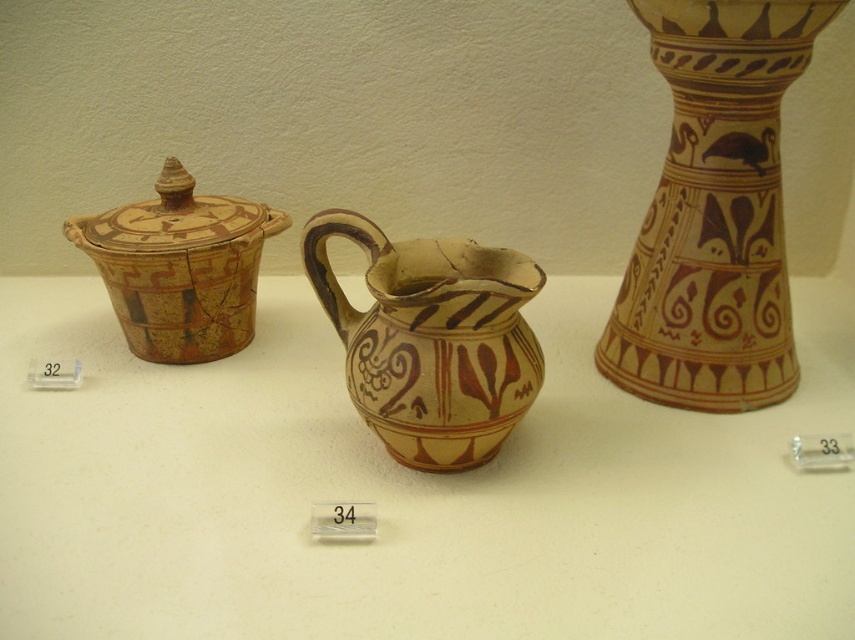
Question: Among these points, which one is nearest to the camera?

Choices:
 (A) (248, 285)
 (B) (435, 352)
 (C) (700, 513)
 (D) (780, 312)

Answer: (B)

Question: Does matte ceramic pitcher at center appear on the right side of matte clay pot at left?

Choices:
 (A) yes
 (B) no

Answer: (A)

Question: Is matte ceramic pitcher at center positioned before matte clay pitcher at center?

Choices:
 (A) no
 (B) yes

Answer: (B)

Question: Based on their relative distances, which object is nearer to the matte clay pot at left?

Choices:
 (A) matte ceramic pitcher at center
 (B) matte clay pitcher at center

Answer: (A)

Question: Which point appears closest to the camera in this image?

Choices:
 (A) (139, 301)
 (B) (325, 627)

Answer: (B)

Question: Does matte clay pitcher at center appear under matte clay pot at left?

Choices:
 (A) no
 (B) yes

Answer: (B)